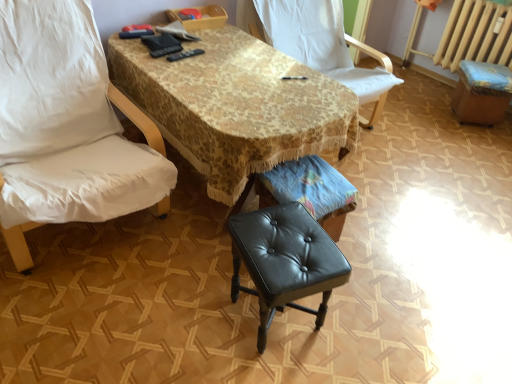
What are the coordinates of `blank space to the left of black leather bar stool at lower right` in the screenshot? It's located at (430, 114).